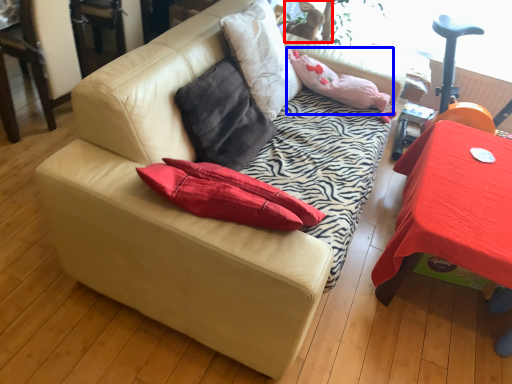
Question: Which object is further to the camera taking this photo, animal (highlighted by a red box) or pillow (highlighted by a blue box)?

Choices:
 (A) animal
 (B) pillow

Answer: (A)